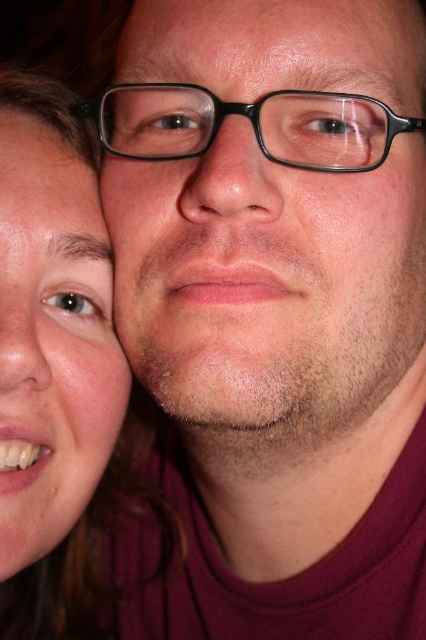
You are a photographer trying to capture a portrait of the couple. You need to ensure that both the matte black glasses at center and the smooth skin at upper center are in focus. Given that your camera can only focus on objects within a 10 inch range, will you need to adjust your focus settings?

The matte black glasses at center is 11.18 inches away from smooth skin at upper center. Since the distance exceeds the camera focus range of 10 inches, you will need to adjust your focus settings to ensure both are in focus.

You are a photographer trying to capture a closeup of both the matte black glasses at center and the matte skin face at lower left in the image. Can you fit both subjects into the frame without moving the camera? Explain why or why not based on their positions.

The matte black glasses at center is positioned over the matte skin face at lower left, meaning the glasses are covering part of the face. Since the glasses are already overlapping the face, it might be challenging to clearly capture both subjects in the frame without moving the camera as their positions are overlapping.

Based on the scene description, where exactly is the matte black glasses at center located in terms of coordinates?

The matte black glasses at center is located at coordinates point (268, 284).